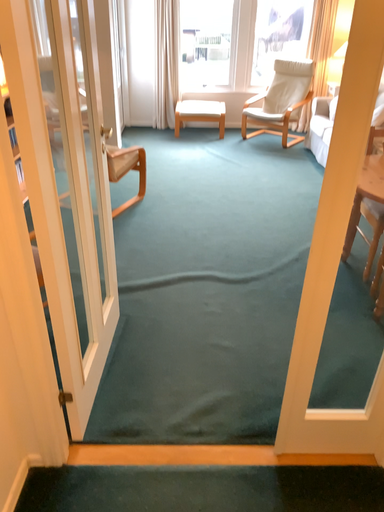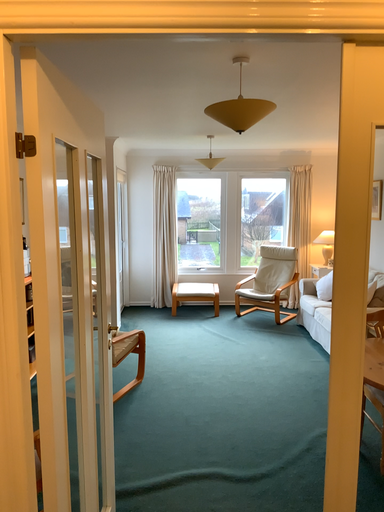
Question: Which way did the camera rotate in the video?

Choices:
 (A) rotated downward
 (B) rotated upward

Answer: (B)